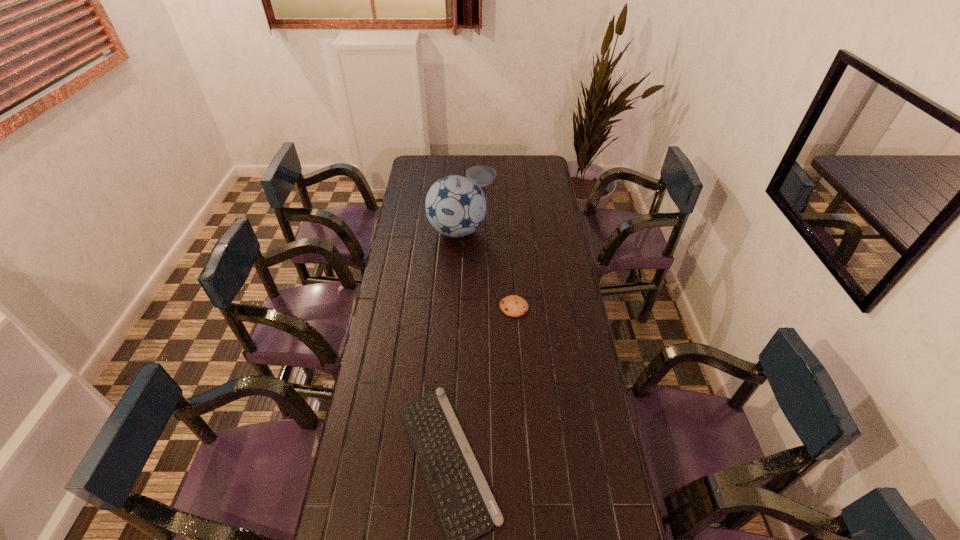
In the image, there is a desktop. Where is `vacant region at the far edge`? vacant region at the far edge is located at coordinates (499, 156).

You are a GUI agent. You are given a task and a screenshot of the screen. Output one action in this format:
    pyautogui.click(x=<x>, y=<y>)
    Task: Click on the vacant space at the left edge of the desktop
    
    Given the screenshot: What is the action you would take?
    pyautogui.click(x=425, y=267)

The image size is (960, 540). Identify the location of free space at the right edge of the desktop. (586, 465).

I want to click on vacant space at the far right corner of the desktop, so click(x=546, y=164).

The width and height of the screenshot is (960, 540). I want to click on unoccupied area between the soccer ball and the cookie, so click(x=486, y=269).

Identify which object is the third nearest to the cookie. Please provide its 2D coordinates. Your answer should be formatted as a tuple, i.e. [(x, y)], where the tuple contains the x and y coordinates of a point satisfying the conditions above.

[(483, 175)]

Identify which object is located as the second nearest to the computer keyboard. Please provide its 2D coordinates. Your answer should be formatted as a tuple, i.e. [(x, y)], where the tuple contains the x and y coordinates of a point satisfying the conditions above.

[(455, 205)]

At what (x,y) coordinates should I click in order to perform the action: click on free point that satisfies the following two spatial constraints: 1. on the side with brand of the cookie; 2. on the right side of the tallest object. Please return your answer as a coordinate pair (x, y). This screenshot has width=960, height=540. Looking at the image, I should click on (452, 307).

Locate an element on the screen. blank area in the image that satisfies the following two spatial constraints: 1. on the side with brand of the third farthest object; 2. on the left side of the tallest object is located at coordinates (452, 307).